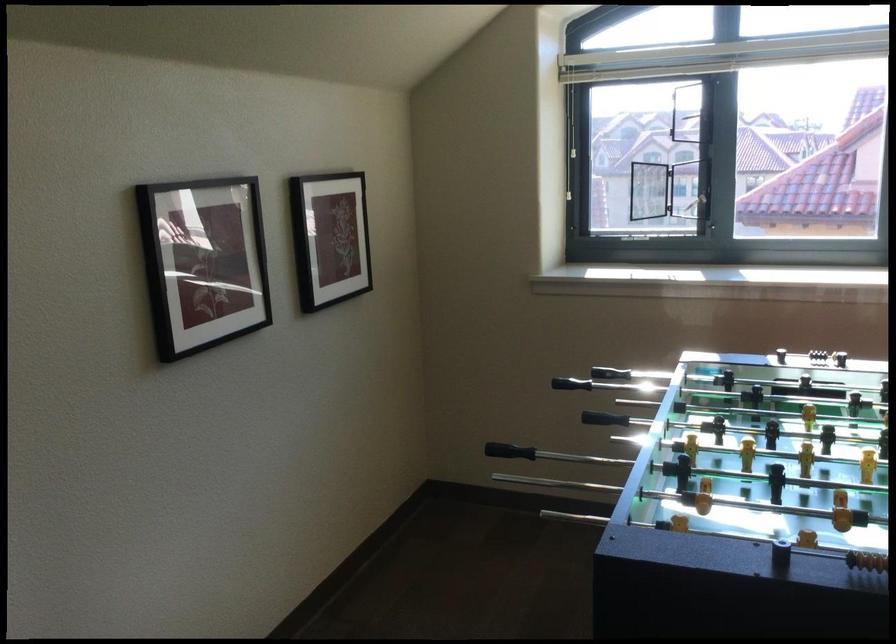
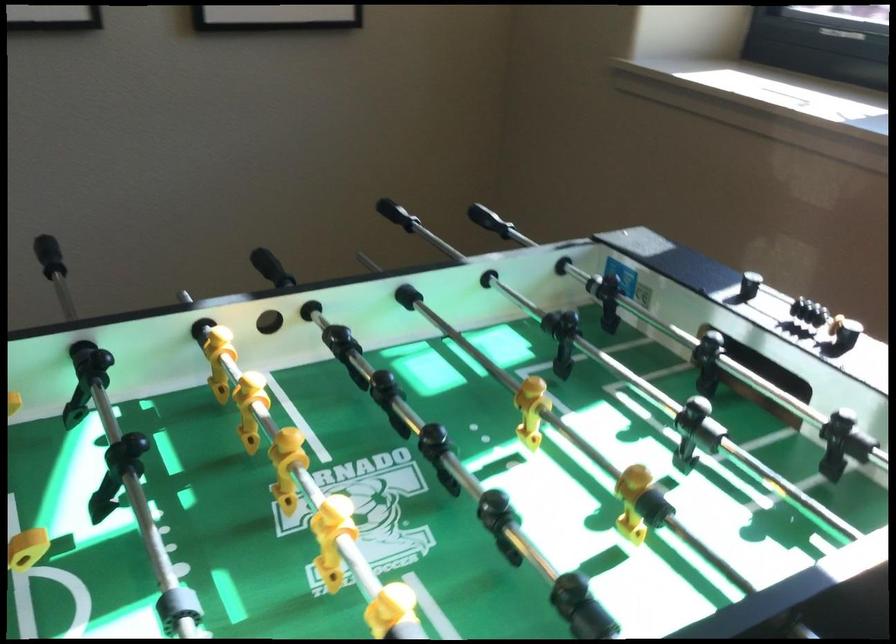
Locate, in the second image, the point that corresponds to point (231, 518) in the first image.

(48, 256)